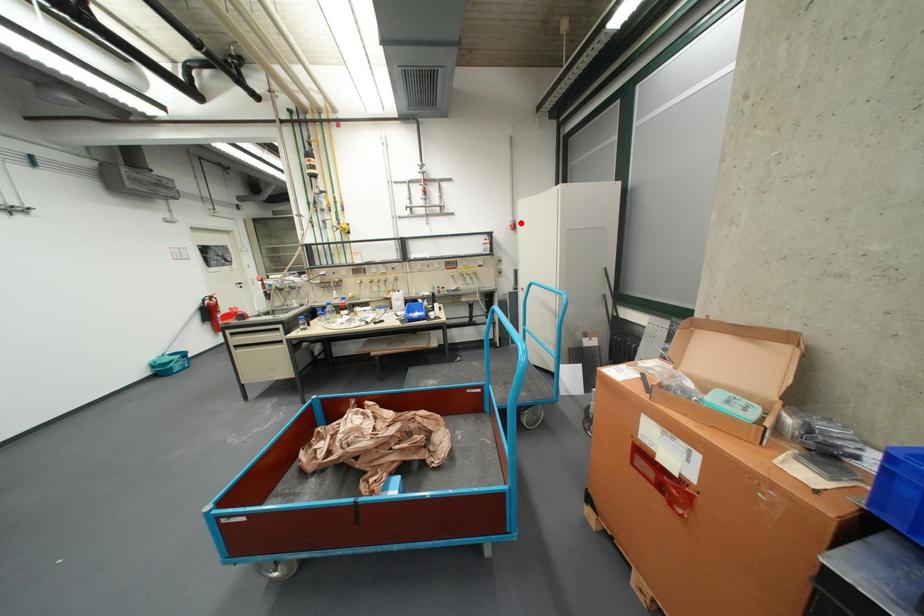
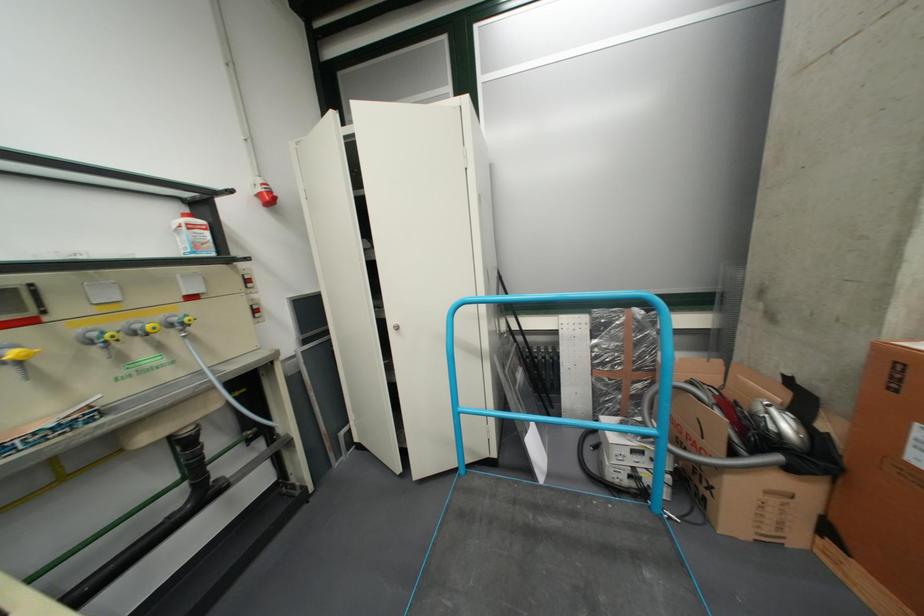
Locate, in the second image, the point that corresponds to the highlighted location in the first image.

(260, 185)